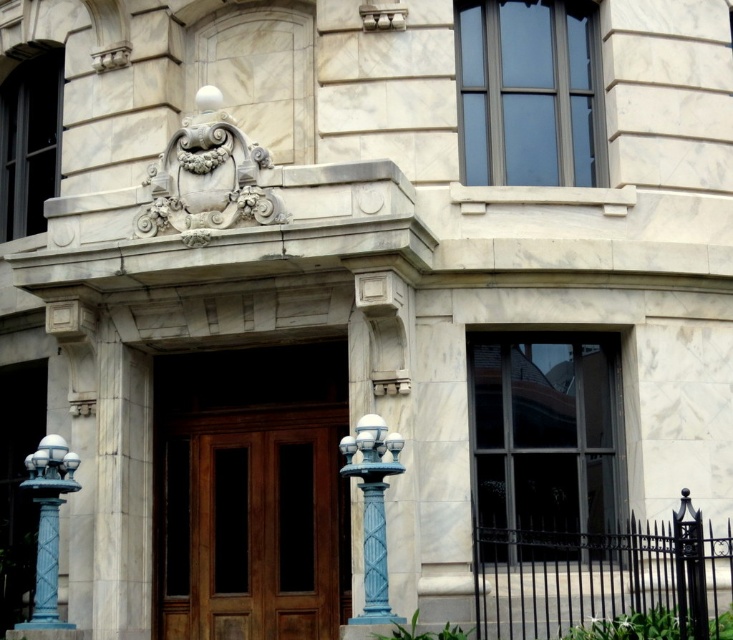
You are standing at the entrance of a grand building and want to take a photo of the polished wood door at center. If your camera has a maximum focus range of 50 meters, will it be able to capture the door clearly?

The polished wood door at center is 47.35 meters away from the camera. Since this distance is within the camera maximum focus range of 50 meters, the camera can capture the door clearly.

You are standing at the entrance of the grand building and want to take a photo. There are two points marked in the image, point 1 at coordinates point (346,444) and point 2 at coordinates point (23,484). Which point is closer to your camera lens when taking the photo?

Point (346,444) is closer to the camera than point (23,484).